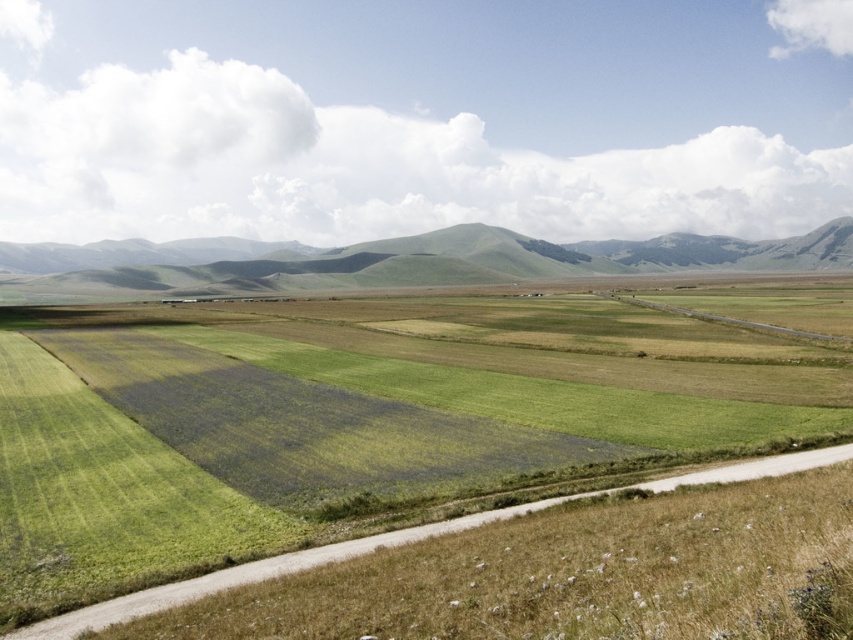
You are a hiker standing at the edge of the dirt road in the lower right corner of the image. You want to reach the green grassy hill at center. Which direction should you walk to get there first without going around the green grassland at center?

You should walk towards the center of the image because the green grassland at center is in front of the green grassy hill at center, so moving towards the center will lead you directly to the green grassy hill at center without needing to go around the green grassland at center.